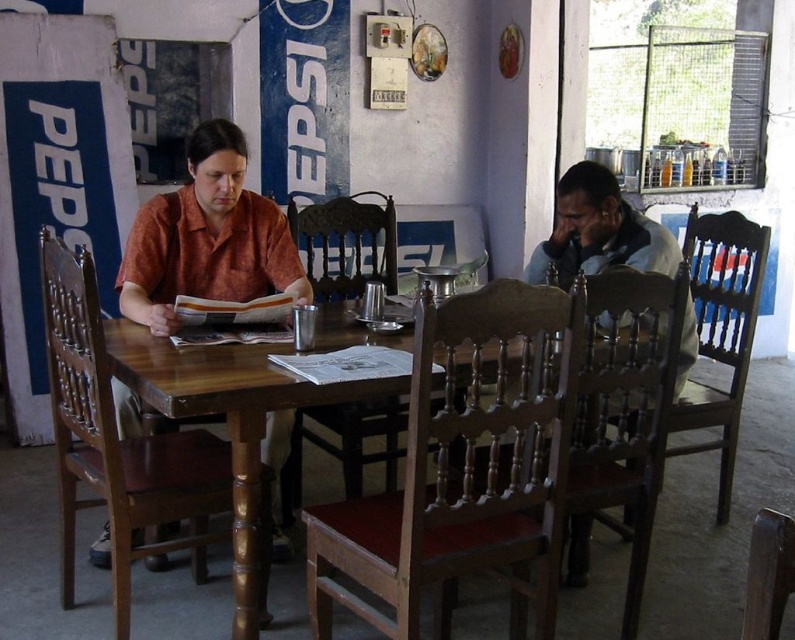
Question: Can you confirm if brown wood chair at center is thinner than wooden chair at lower right?

Choices:
 (A) no
 (B) yes

Answer: (A)

Question: Is brown wood chair at center to the right of wooden chair at right from the viewer's perspective?

Choices:
 (A) no
 (B) yes

Answer: (A)

Question: Which is nearer to the brown wooden chair at right?

Choices:
 (A) wooden chair at right
 (B) wooden chair at lower right
 (C) wooden table at center

Answer: (C)

Question: Which point is farther to the camera?

Choices:
 (A) wooden table at center
 (B) brown wooden chair at right
 (C) wooden chair at center
 (D) wooden chair at right

Answer: (C)

Question: Considering the real-world distances, which object is farthest from the wooden table at center?

Choices:
 (A) brown wood chair at left
 (B) wooden chair at right
 (C) wooden chair at center
 (D) wooden chair at lower right

Answer: (B)

Question: From the image, what is the correct spatial relationship of brown wooden chair at right in relation to wooden table at center?

Choices:
 (A) above
 (B) below

Answer: (B)